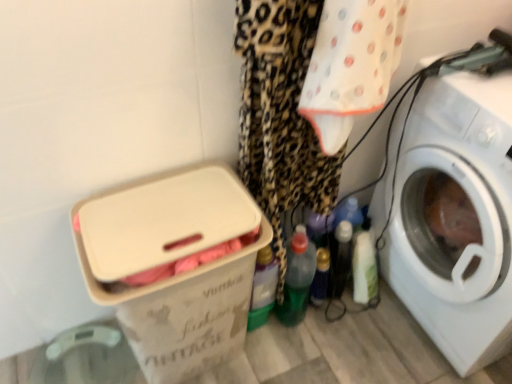
The height and width of the screenshot is (384, 512). In order to click on free space in front of green plastic bottle at center, which is counted as the second bottle, starting from the right in this screenshot , I will do `click(298, 356)`.